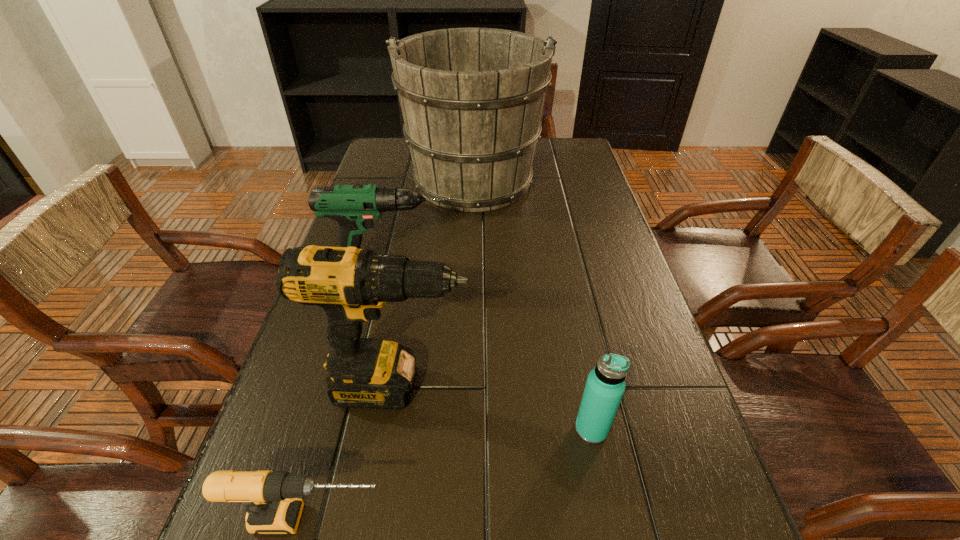
Locate an element on the screen. The height and width of the screenshot is (540, 960). bucket is located at coordinates (472, 98).

At what (x,y) coordinates should I click in order to perform the action: click on the tallest object. Please return your answer as a coordinate pair (x, y). Looking at the image, I should click on (472, 98).

I want to click on the second nearest drill, so click(350, 284).

Find the location of `the third farthest object`. the third farthest object is located at coordinates (350, 284).

Where is `the farthest drill`? Image resolution: width=960 pixels, height=540 pixels. the farthest drill is located at coordinates (353, 206).

This screenshot has height=540, width=960. I want to click on the third tallest object, so [x=353, y=206].

Identify the location of the fourth tallest object. (605, 385).

The height and width of the screenshot is (540, 960). Identify the location of the second nearest object. (605, 385).

Identify the location of the shortest object. [270, 498].

Where is `the nearest object`? The image size is (960, 540). the nearest object is located at coordinates (270, 498).